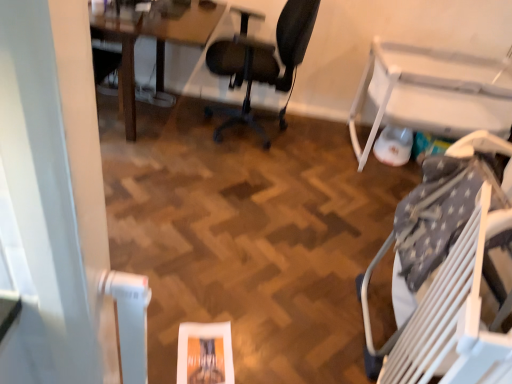
Find the location of `vacant space underneath black mesh office chair at center, acting as the second chair starting from the right (from a real-world perspective)`. vacant space underneath black mesh office chair at center, acting as the second chair starting from the right (from a real-world perspective) is located at coordinates (237, 129).